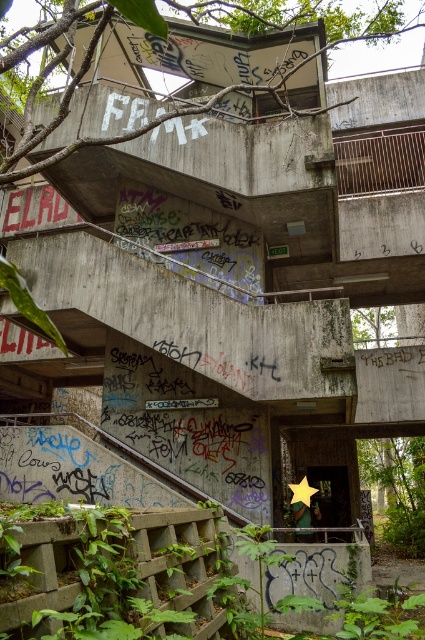
Question: Can you confirm if green leafy plants at lower left is thinner than green leafy vegetation at lower right?

Choices:
 (A) no
 (B) yes

Answer: (B)

Question: Is green leafy plants at lower left behind green leafy vegetation at lower right?

Choices:
 (A) yes
 (B) no

Answer: (B)

Question: Is green leafy plants at lower left to the right of green leafy vegetation at lower right from the viewer's perspective?

Choices:
 (A) yes
 (B) no

Answer: (B)

Question: Which point is farther to the camera?

Choices:
 (A) green leafy vegetation at lower right
 (B) green leafy plants at lower left

Answer: (A)

Question: Among these objects, which one is nearest to the camera?

Choices:
 (A) green leafy plants at lower left
 (B) green leafy vegetation at lower right

Answer: (A)

Question: Which of the following is the farthest from the observer?

Choices:
 (A) green leafy plants at lower left
 (B) green leafy vegetation at lower right

Answer: (B)